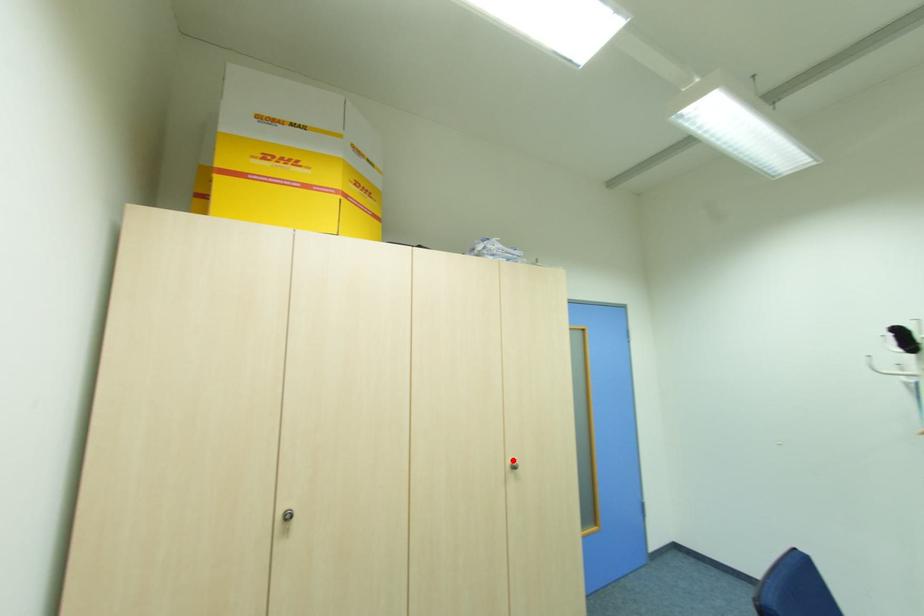
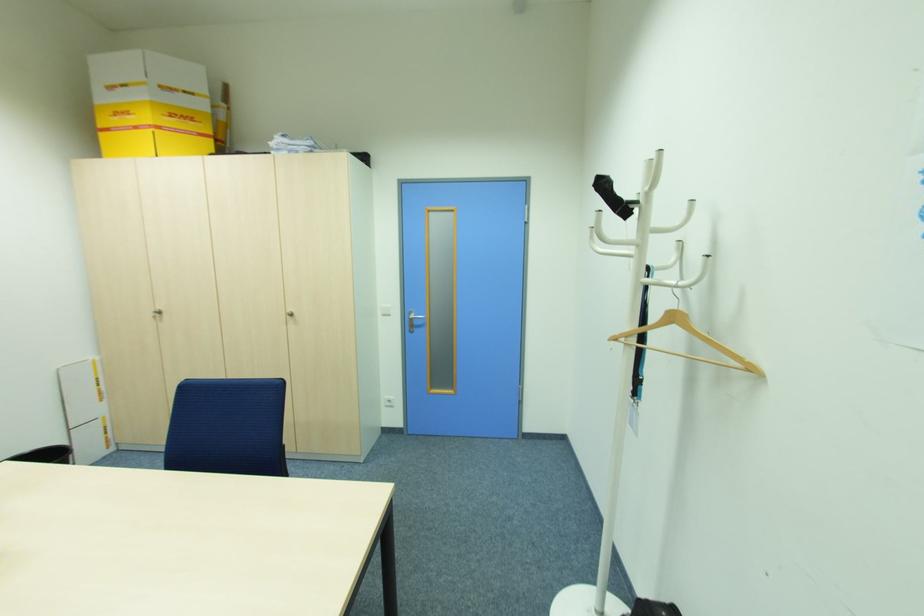
Question: I am providing you with two images of the same scene from different viewpoints. A red point is marked on the first image. Can you still see the location of the red point in image 2?

Choices:
 (A) Yes
 (B) No

Answer: (A)